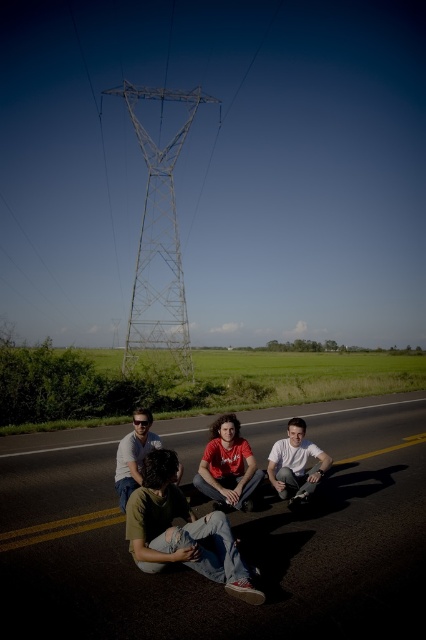
You are standing at the point marked as point (x=236, y=536). What is the closest object to you in the scene?

The closest object to you at point (x=236, y=536) is the black asphalt highway at center, as you are standing directly on it.

You are a photographer standing at a position where you can see both the point at coordinates point (396, 403) and the point at coordinates point (207, 468). Which point do you need to focus on first if you want to capture both in a single photo without moving your camera?

You should focus on point (396, 403) first because it is closer to the camera than point (207, 468), ensuring both points are in focus when using a single focal plane.

Looking at this image, you are a photographer trying to capture a shot of the green denim jeans at lower left and the light gray smooth skateboard at center. Which object should you focus on first if you want to ensure both are in the frame without moving the camera?

The green denim jeans at lower left is taller than the light gray smooth skateboard at center, so you should focus on the green denim jeans at lower left first to ensure both are in the frame.